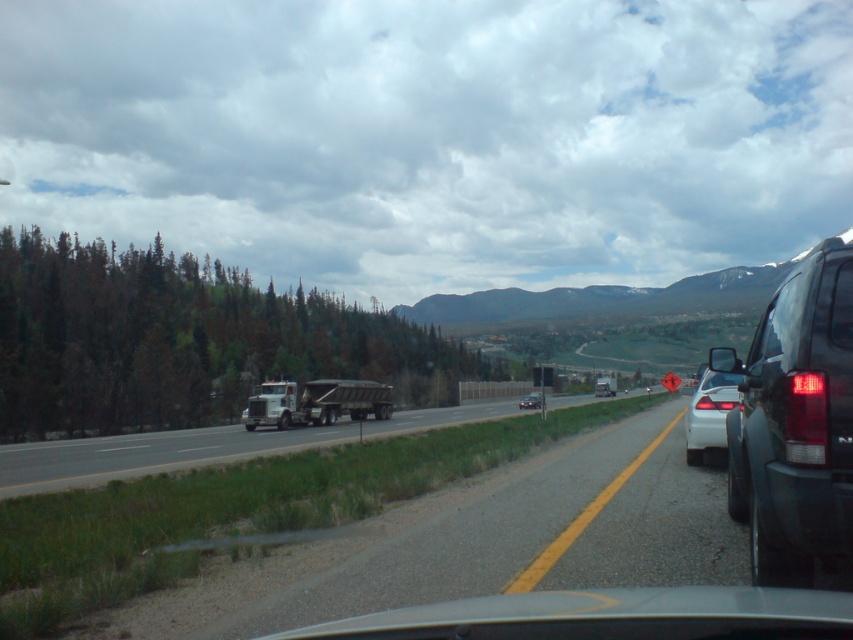
Which is behind, point (737, 388) or point (527, 401)?

The point (527, 401) is behind.

Does point (744, 480) come behind point (541, 401)?

No.

Identify the location of black glossy suv at right. The image size is (853, 640). (795, 420).

Can you confirm if black glossy suv at right is positioned below black plastic license plate at right?

Incorrect, black glossy suv at right is not positioned below black plastic license plate at right.

Does black glossy suv at right have a smaller size compared to black plastic license plate at right?

No.

Who is more distant from viewer, (776,291) or (811,445)?

The point (776,291) is behind.

Find the location of a particular element. The width and height of the screenshot is (853, 640). black glossy suv at right is located at coordinates (795, 420).

Does black glossy suv at right appear over metallic silver dump truck at center?

Indeed, black glossy suv at right is positioned over metallic silver dump truck at center.

Does black glossy suv at right appear on the right side of metallic silver dump truck at center?

Correct, you'll find black glossy suv at right to the right of metallic silver dump truck at center.

The height and width of the screenshot is (640, 853). Identify the location of black glossy suv at right. (795, 420).

Locate an element on the screen. black glossy suv at right is located at coordinates (795, 420).